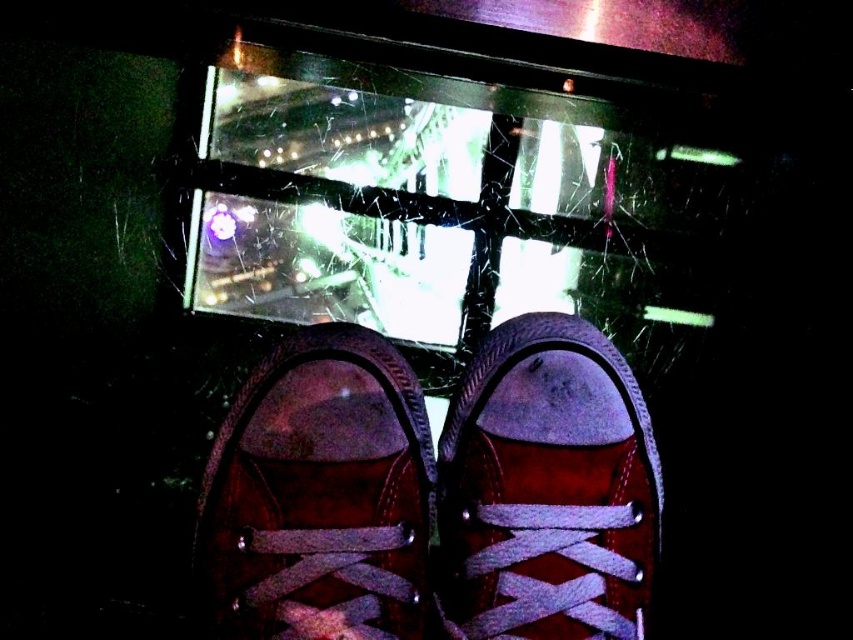
Does shiny brown shoe at center have a smaller size compared to suede/leather sneaker at center?

Incorrect, shiny brown shoe at center is not smaller in size than suede/leather sneaker at center.

Which is behind, point (352, 410) or point (525, 492)?

Positioned behind is point (525, 492).

Describe the element at coordinates (320, 497) in the screenshot. The image size is (853, 640). I see `shiny brown shoe at center` at that location.

You are a GUI agent. You are given a task and a screenshot of the screen. Output one action in this format:
    pyautogui.click(x=<x>, y=<y>)
    Task: Click on the shiny brown shoe at center
    
    Given the screenshot: What is the action you would take?
    pyautogui.click(x=320, y=497)